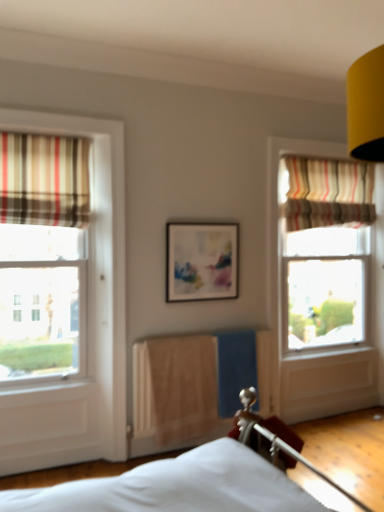
Question: Is the position of beige fabric radiator at center less distant than that of striped fabric curtain at left, the 1th curtain in the front-to-back sequence?

Choices:
 (A) yes
 (B) no

Answer: (B)

Question: From the image's perspective, is beige fabric radiator at center above striped fabric curtain at left, the 1th curtain in the front-to-back sequence?

Choices:
 (A) yes
 (B) no

Answer: (B)

Question: Would you say beige fabric radiator at center is a long distance from striped fabric curtain at left, the 2th curtain positioned from the back?

Choices:
 (A) yes
 (B) no

Answer: (A)

Question: Is beige fabric radiator at center thinner than striped fabric curtain at left, which is the 2th curtain in right-to-left order?

Choices:
 (A) yes
 (B) no

Answer: (A)

Question: Does beige fabric radiator at center come behind striped fabric curtain at left, the 2th curtain positioned from the back?

Choices:
 (A) no
 (B) yes

Answer: (B)

Question: From a real-world perspective, is beige fabric radiator at center located higher than striped fabric curtain at left, the 2th curtain positioned from the back?

Choices:
 (A) yes
 (B) no

Answer: (B)

Question: Is the position of beige fabric radiator at center less distant than that of matte plastic picture frame at center?

Choices:
 (A) yes
 (B) no

Answer: (A)

Question: Is the surface of beige fabric radiator at center in direct contact with matte plastic picture frame at center?

Choices:
 (A) yes
 (B) no

Answer: (B)

Question: From a real-world perspective, is beige fabric radiator at center beneath matte plastic picture frame at center?

Choices:
 (A) no
 (B) yes

Answer: (B)

Question: Does beige fabric radiator at center appear on the left side of matte plastic picture frame at center?

Choices:
 (A) yes
 (B) no

Answer: (B)

Question: From a real-world perspective, is beige fabric radiator at center on top of matte plastic picture frame at center?

Choices:
 (A) yes
 (B) no

Answer: (B)

Question: Does beige fabric radiator at center have a lesser height compared to matte plastic picture frame at center?

Choices:
 (A) no
 (B) yes

Answer: (A)

Question: Is striped fabric curtain at upper right, which ranks as the 2th curtain in front-to-back order, completely or partially inside beige fabric radiator at center?

Choices:
 (A) yes
 (B) no

Answer: (B)